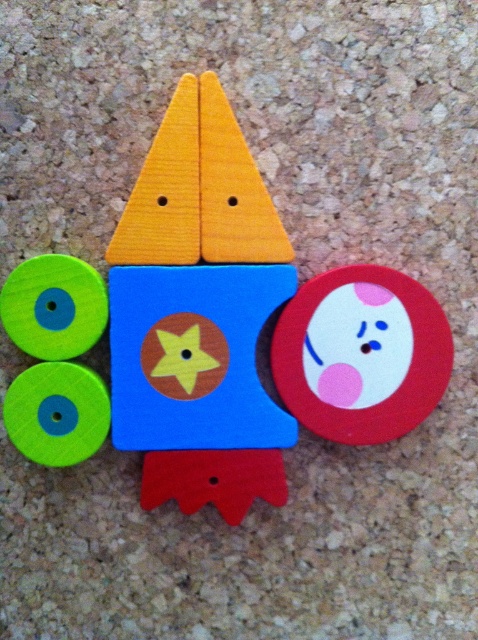
You are trying to fit both the wooden rocket at center and the matte red circle at center into a rectangular box that can only accommodate one of them. Based on their widths, which object should you choose to place in the box?

The wooden rocket at center is wider than the matte red circle at center, so you should choose the wooden rocket at center to place in the box since it requires more space.

In the scene shown: You are an astronaut looking at the wooden rocket at center and the matte red circle at center in the image. Which object is positioned higher from the ground?

The wooden rocket at center is located above the matte red circle at center, so it is positioned higher from the ground.

You are looking at the colorful wooden toy. There is a point marked at coordinates (225,332). What object is located at this point?

The point at (225,332) corresponds to the wooden rocket at center.